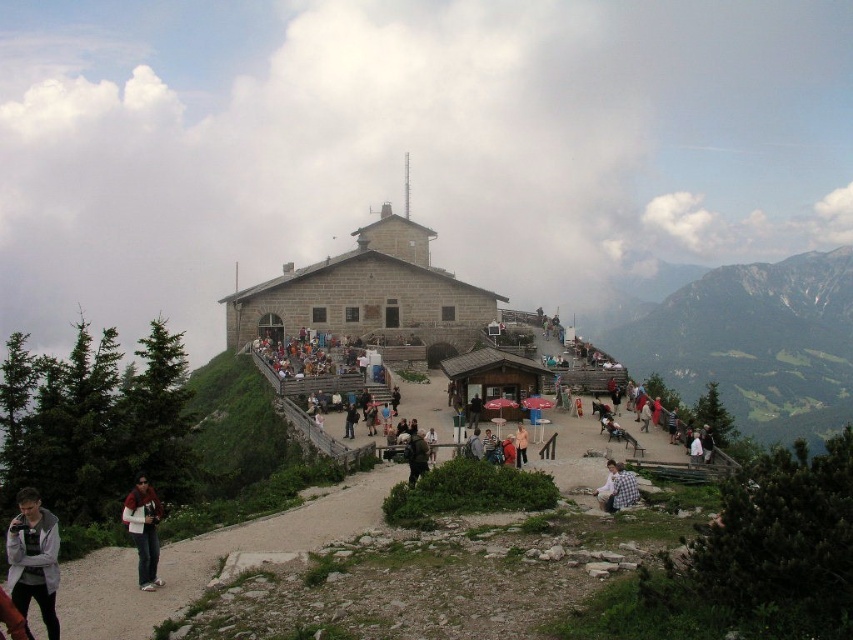
Question: Considering the relative positions of gray stone building at center and checkered fabric shirt at lower right in the image provided, where is gray stone building at center located with respect to checkered fabric shirt at lower right?

Choices:
 (A) right
 (B) left

Answer: (B)

Question: Can you confirm if gray stone building at center is positioned to the right of checkered fabric shirt at lower right?

Choices:
 (A) yes
 (B) no

Answer: (B)

Question: Which is nearer to the matte black jacket at lower left?

Choices:
 (A) dark gray jacket at center
 (B) gray fleece jacket at lower left
 (C) checkered fabric shirt at lower right
 (D) gray stone building at center

Answer: (B)

Question: Estimate the real-world distances between objects in this image. Which object is farther from the dark gray jacket at center?

Choices:
 (A) checkered fabric shirt at lower right
 (B) gray fleece jacket at lower left
 (C) gray stone building at center
 (D) matte black jacket at lower left

Answer: (C)

Question: Which object is farther from the camera taking this photo?

Choices:
 (A) dark gray jacket at center
 (B) gray stone building at center

Answer: (B)

Question: Does gray fleece jacket at lower left have a smaller size compared to matte black jacket at lower left?

Choices:
 (A) yes
 (B) no

Answer: (B)